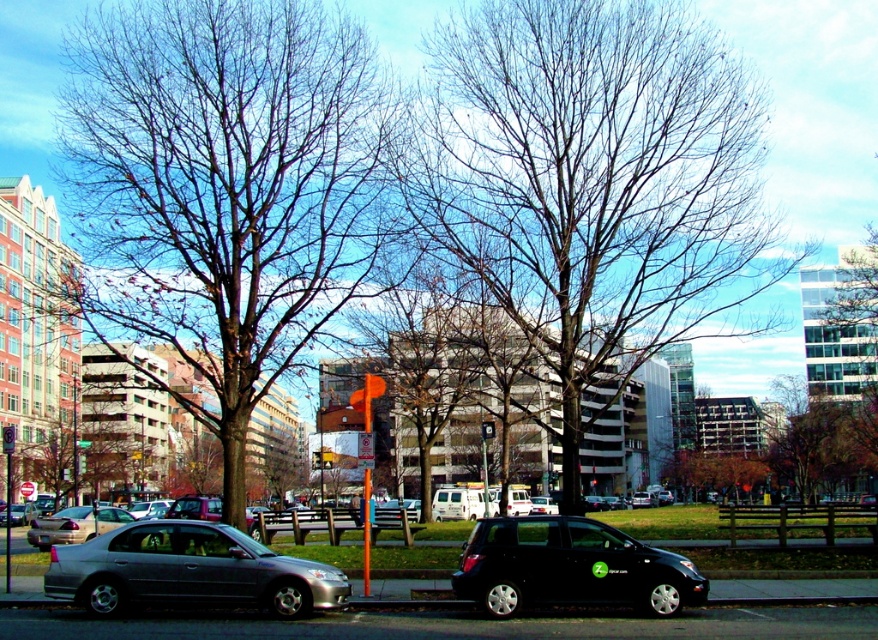
Who is more forward, (137, 252) or (88, 508)?

Point (137, 252)

Which is more to the left, bare wood tree at center or silver metallic sedan at center?

silver metallic sedan at center

You are a GUI agent. You are given a task and a screenshot of the screen. Output one action in this format:
    pyautogui.click(x=<x>, y=<y>)
    Task: Click on the bare wood tree at center
    The height and width of the screenshot is (640, 878).
    Given the screenshot: What is the action you would take?
    pyautogui.click(x=225, y=188)

Where is `bare wood tree at center`? Image resolution: width=878 pixels, height=640 pixels. bare wood tree at center is located at coordinates (225, 188).

Where is `black glossy hatchback at center`? This screenshot has height=640, width=878. black glossy hatchback at center is located at coordinates (570, 566).

Who is positioned more to the right, black glossy hatchback at center or silver metallic sedan at center?

black glossy hatchback at center is more to the right.

This screenshot has width=878, height=640. I want to click on black glossy hatchback at center, so click(570, 566).

Measure the distance from metallic gray sedan at lower left to silver metallic sedan at center.

The distance of metallic gray sedan at lower left from silver metallic sedan at center is 17.00 meters.

Is metallic gray sedan at lower left below silver metallic sedan at center?

Incorrect, metallic gray sedan at lower left is not positioned below silver metallic sedan at center.

Is point (130, 545) farther from viewer compared to point (106, 509)?

No, (130, 545) is closer to viewer.

Image resolution: width=878 pixels, height=640 pixels. Find the location of `metallic gray sedan at lower left`. metallic gray sedan at lower left is located at coordinates (189, 572).